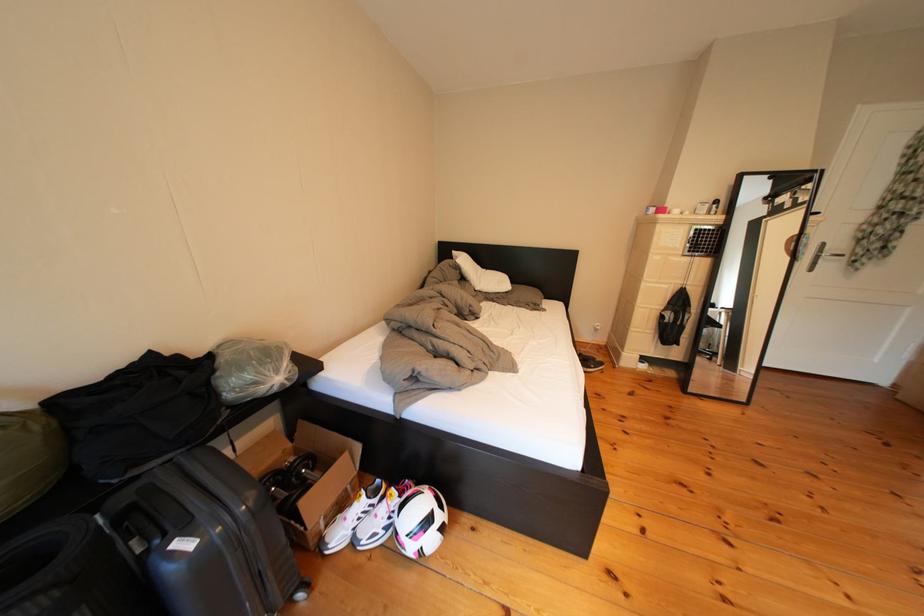
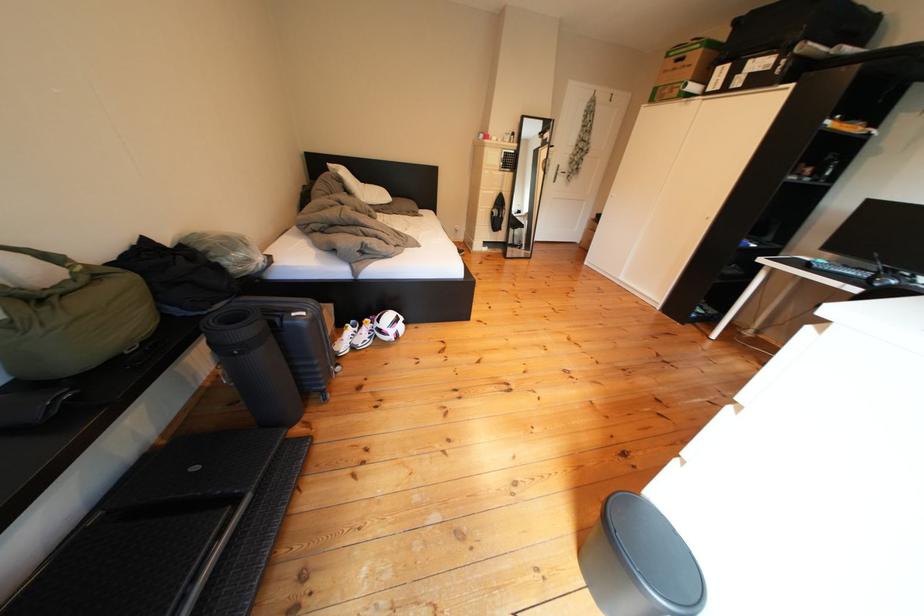
Locate, in the second image, the point that corresponds to (x=832, y=262) in the first image.

(570, 179)